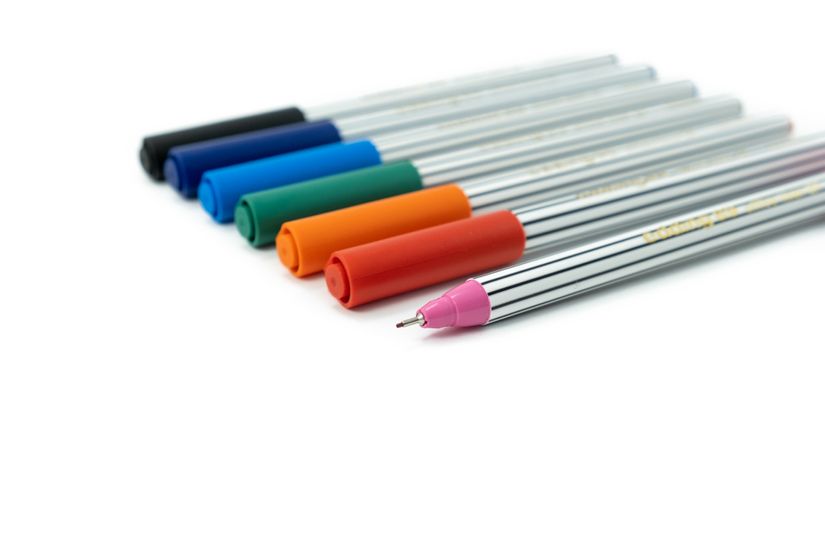
Locate an element on the screen. The width and height of the screenshot is (825, 550). pen caps is located at coordinates (166, 144), (187, 167), (234, 180), (276, 202), (323, 233), (365, 267).